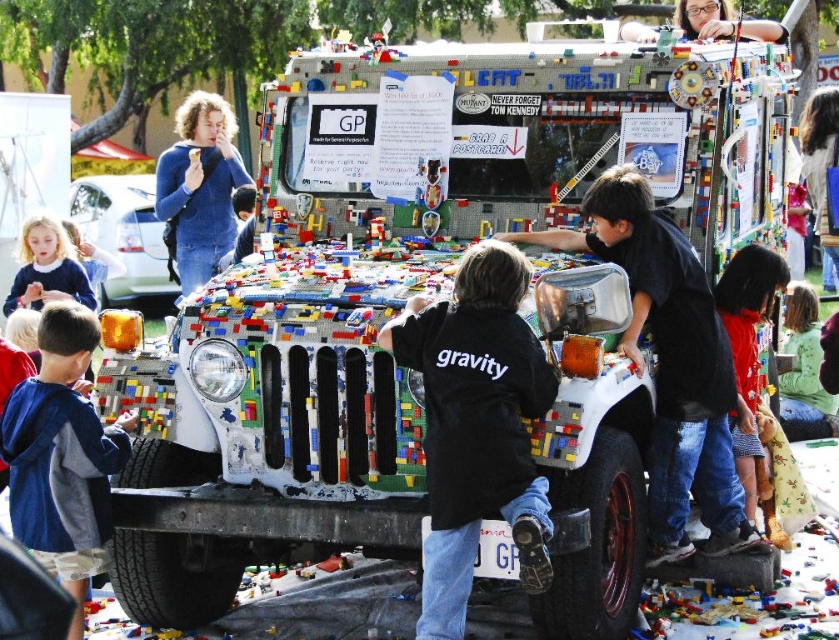
What do you see at coordinates (670, 362) in the screenshot?
I see `black cotton shirt at center` at bounding box center [670, 362].

In the scene shown: Who is lower down, black cotton shirt at center or white plastic car at upper left?

black cotton shirt at center

Between point (722, 508) and point (110, 182), which one is positioned behind?

The point (110, 182) is more distant.

At what (x,y) coordinates should I click in order to perform the action: click on black cotton shirt at center. Please return your answer as a coordinate pair (x, y). The image size is (839, 640). Looking at the image, I should click on (670, 362).

What do you see at coordinates (477, 426) in the screenshot?
I see `black matte jacket at center` at bounding box center [477, 426].

Is point (421, 324) positioned in front of point (788, 346)?

Yes, point (421, 324) is closer to viewer.

Who is more distant from viewer, (451, 360) or (827, 435)?

The point (827, 435) is behind.

The height and width of the screenshot is (640, 839). What are the coordinates of `black matte jacket at center` in the screenshot? It's located at (477, 426).

Which is behind, point (618, 193) or point (90, 532)?

The point (618, 193) is more distant.

Who is more distant from viewer, [608,170] or [105,525]?

Positioned behind is point [608,170].

The height and width of the screenshot is (640, 839). What are the coordinates of `black cotton shirt at center` in the screenshot? It's located at (670, 362).